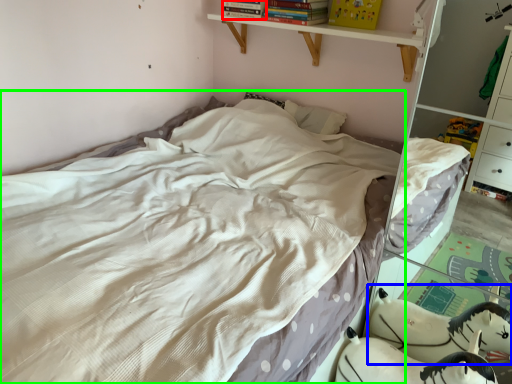
Question: Which is nearer to the book (highlighted by a red box)? animal (highlighted by a blue box) or bed (highlighted by a green box).

Choices:
 (A) animal
 (B) bed

Answer: (B)